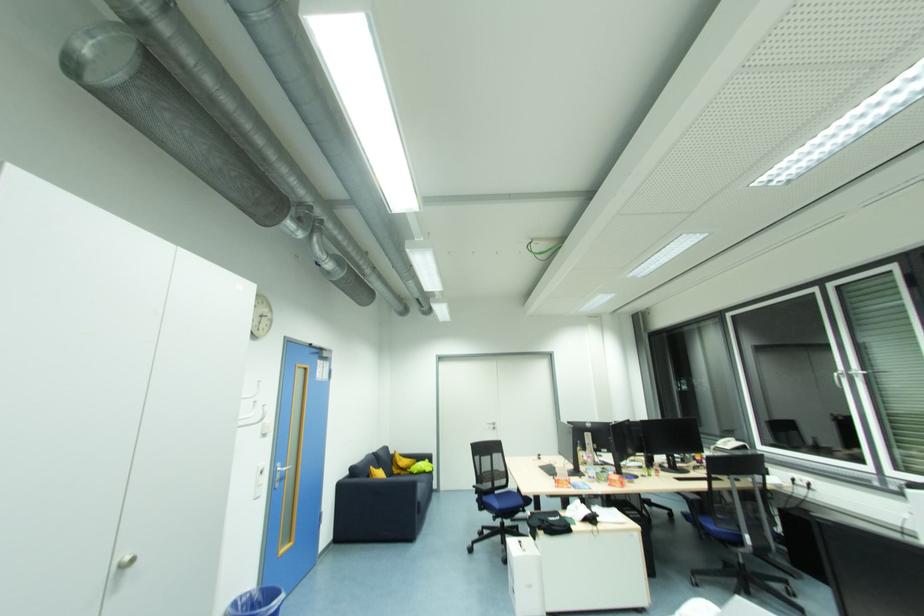
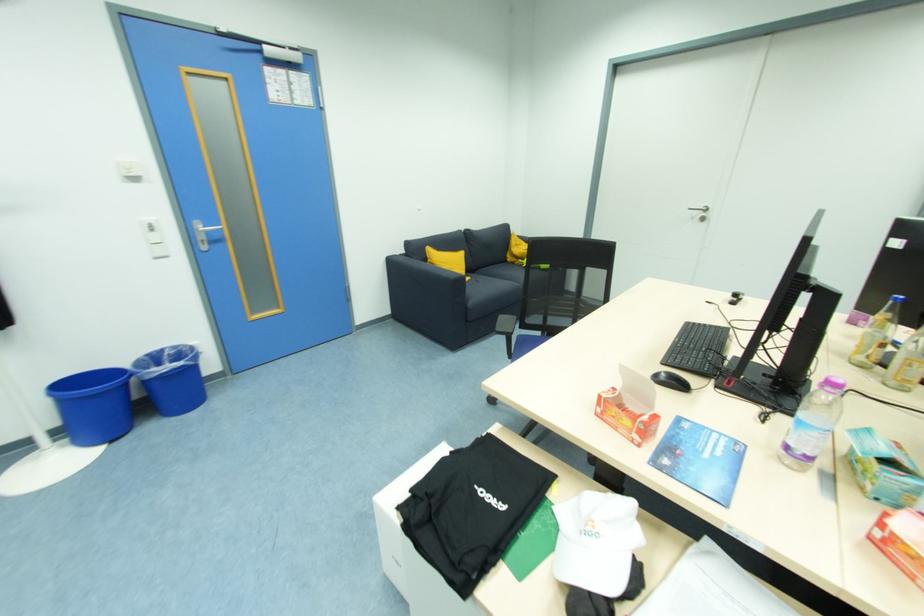
Locate, in the second image, the point that corresponds to pixel 402 475 in the first image.

(516, 265)